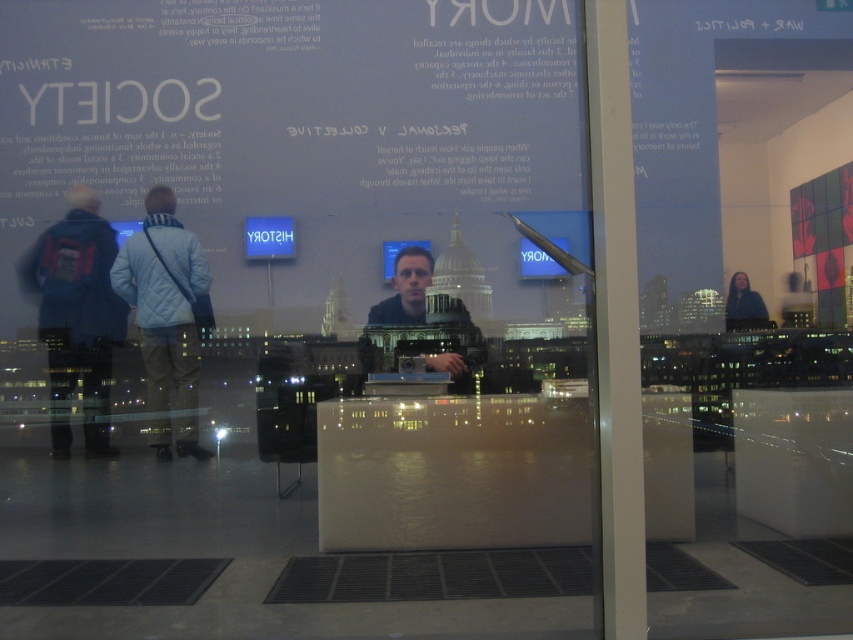
Looking at this image, who is taller, transparent glass door at right or dark blue jacket at right?

Standing taller between the two is dark blue jacket at right.

Is point (762, 420) farther from camera compared to point (746, 292)?

No, (762, 420) is closer to viewer.

At what (x,y) coordinates should I click in order to perform the action: click on transparent glass door at right. Please return your answer as a coordinate pair (x, y). The width and height of the screenshot is (853, 640). Looking at the image, I should click on (763, 301).

Is denim jacket at left positioned in front of light blue quilted jacket at left?

Yes, it is.

Between denim jacket at left and light blue quilted jacket at left, which one appears on the right side from the viewer's perspective?

Positioned to the right is light blue quilted jacket at left.

Which is behind, point (55, 365) or point (196, 292)?

Positioned behind is point (55, 365).

You are a GUI agent. You are given a task and a screenshot of the screen. Output one action in this format:
    pyautogui.click(x=<x>, y=<y>)
    Task: Click on the denim jacket at left
    The width and height of the screenshot is (853, 640).
    Given the screenshot: What is the action you would take?
    pyautogui.click(x=76, y=316)

Describe the element at coordinates (165, 317) in the screenshot. The height and width of the screenshot is (640, 853). I see `light blue quilted jacket at left` at that location.

Is light blue quilted jacket at left shorter than dark blue jacket at right?

No, light blue quilted jacket at left is not shorter than dark blue jacket at right.

Where is `light blue quilted jacket at left`? The image size is (853, 640). light blue quilted jacket at left is located at coordinates (165, 317).

I want to click on light blue quilted jacket at left, so click(x=165, y=317).